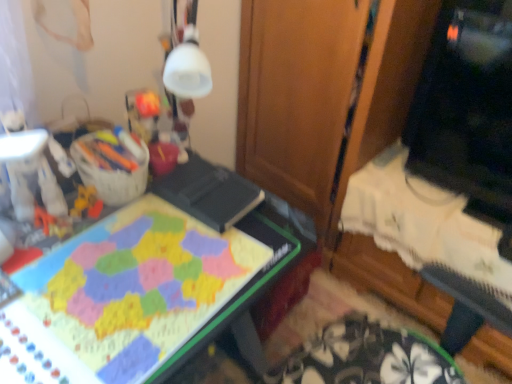
Question: From the image's perspective, does matte plastic board game at center appear lower than wooden at center?

Choices:
 (A) no
 (B) yes

Answer: (B)

Question: From a real-world perspective, is matte plastic board game at center located beneath wooden at center?

Choices:
 (A) yes
 (B) no

Answer: (A)

Question: Is matte plastic board game at center further to the viewer compared to wooden at center?

Choices:
 (A) yes
 (B) no

Answer: (B)

Question: Considering the relative sizes of matte plastic board game at center and wooden at center in the image provided, is matte plastic board game at center bigger than wooden at center?

Choices:
 (A) yes
 (B) no

Answer: (B)

Question: Would you say matte plastic board game at center is outside wooden at center?

Choices:
 (A) no
 (B) yes

Answer: (B)

Question: Considering the relative sizes of matte plastic board game at center and wooden at center in the image provided, is matte plastic board game at center shorter than wooden at center?

Choices:
 (A) no
 (B) yes

Answer: (B)

Question: From a real-world perspective, is wooden at center located beneath matte plastic board game at center?

Choices:
 (A) yes
 (B) no

Answer: (B)

Question: Does wooden at center have a greater height compared to matte plastic board game at center?

Choices:
 (A) no
 (B) yes

Answer: (B)

Question: Is wooden at center far away from matte plastic board game at center?

Choices:
 (A) no
 (B) yes

Answer: (A)

Question: Is wooden at center in contact with matte plastic board game at center?

Choices:
 (A) no
 (B) yes

Answer: (A)

Question: Can you confirm if wooden at center is thinner than matte plastic board game at center?

Choices:
 (A) yes
 (B) no

Answer: (B)

Question: From a real-world perspective, is wooden at center located higher than matte plastic board game at center?

Choices:
 (A) yes
 (B) no

Answer: (A)

Question: Is matte plastic board game at center far away from black glossy monitor at upper right?

Choices:
 (A) no
 (B) yes

Answer: (A)